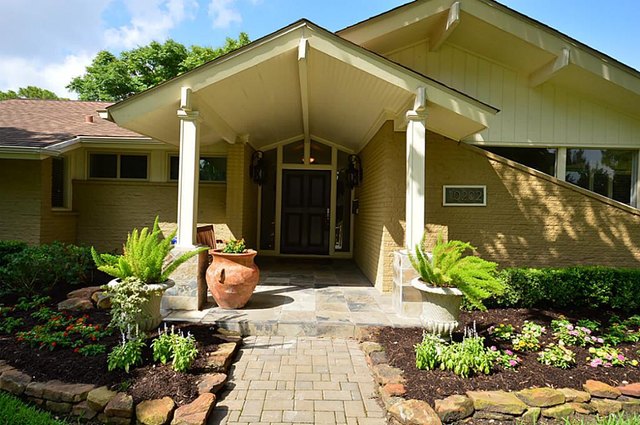
Identify the location of pillar. (417, 195), (194, 163).